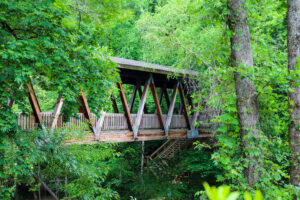
Find the location of a particular element. This screenshot has height=200, width=300. brown beam is located at coordinates (126, 110).